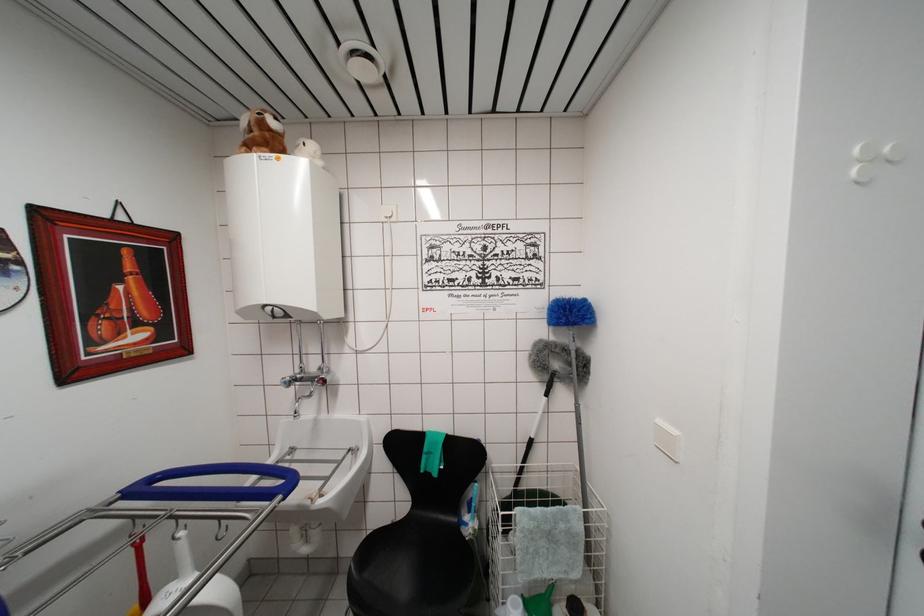
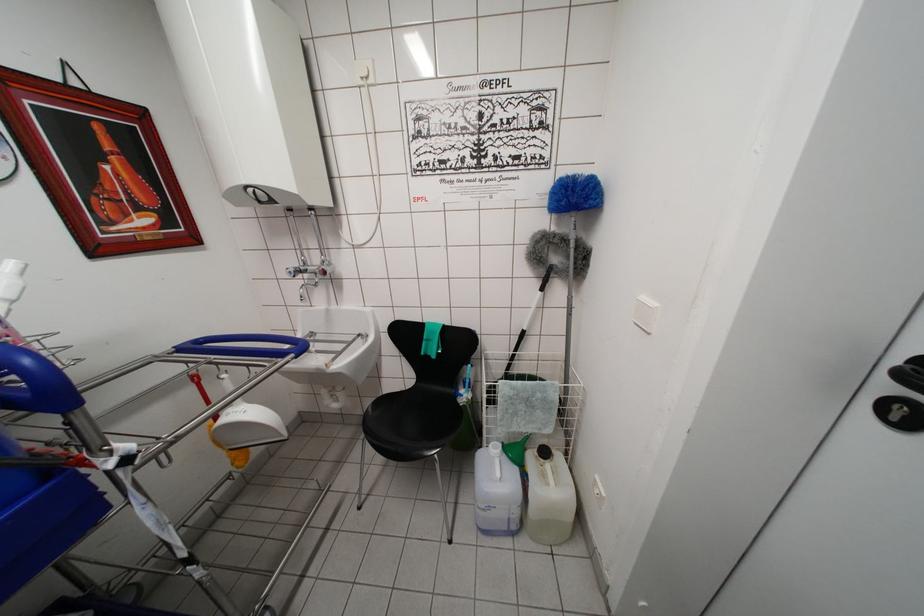
Locate, in the second image, the point that corresponds to [573,369] in the first image.

(572, 261)